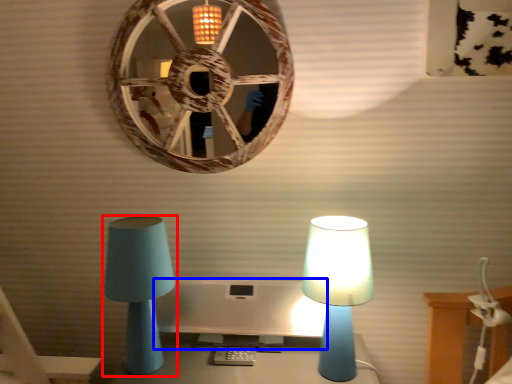
Question: Among these objects, which one is farthest to the camera, lamp (highlighted by a red box) or computer monitor (highlighted by a blue box)?

Choices:
 (A) lamp
 (B) computer monitor

Answer: (B)